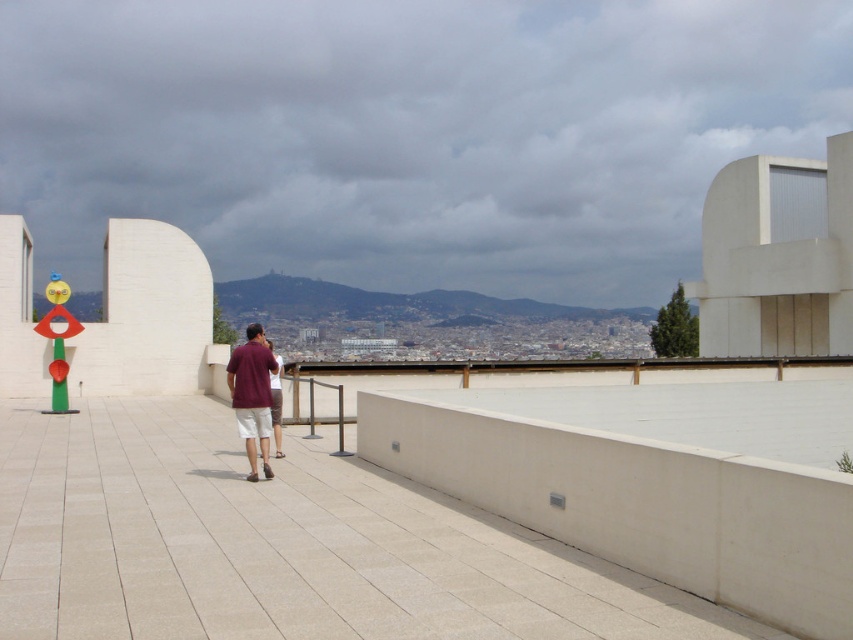
Does point (282, 522) lie behind point (273, 426)?

No, (282, 522) is closer to viewer.

Locate an element on the screen. This screenshot has height=640, width=853. white tile pavement at center is located at coordinates (282, 545).

From the picture: Is the position of matte maroon shirt at center less distant than that of maroon fabric shirt at center?

Yes, it is in front of maroon fabric shirt at center.

Which is behind, point (254, 445) or point (271, 413)?

Point (271, 413)

The image size is (853, 640). What are the coordinates of `matte maroon shirt at center` in the screenshot? It's located at (252, 394).

Is the position of white tile pavement at center more distant than that of matte maroon shirt at center?

No, it is not.

Which is behind, point (83, 605) or point (242, 353)?

Positioned behind is point (242, 353).

Identify the location of white tile pavement at center. (282, 545).